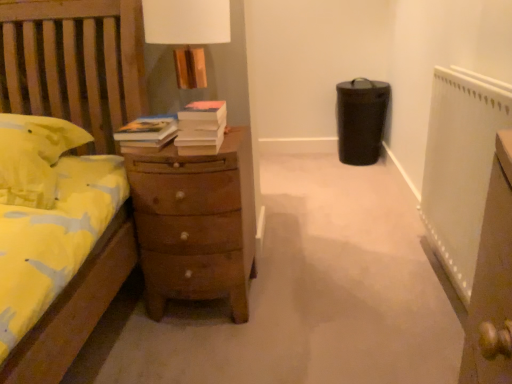
Question: Considering the relative positions of brown wooden chest of drawers at center and white matte book at center in the image provided, is brown wooden chest of drawers at center to the right of white matte book at center from the viewer's perspective?

Choices:
 (A) no
 (B) yes

Answer: (A)

Question: Considering the relative sizes of brown wooden chest of drawers at center and white matte book at center in the image provided, is brown wooden chest of drawers at center thinner than white matte book at center?

Choices:
 (A) no
 (B) yes

Answer: (A)

Question: Does brown wooden chest of drawers at center have a greater height compared to white matte book at center?

Choices:
 (A) no
 (B) yes

Answer: (B)

Question: From a real-world perspective, is brown wooden chest of drawers at center beneath white matte book at center?

Choices:
 (A) no
 (B) yes

Answer: (B)

Question: Considering the relative sizes of brown wooden chest of drawers at center and white matte book at center in the image provided, is brown wooden chest of drawers at center shorter than white matte book at center?

Choices:
 (A) yes
 (B) no

Answer: (B)

Question: Is white matte book at center at the back of brown wooden chest of drawers at center?

Choices:
 (A) no
 (B) yes

Answer: (A)

Question: Is white matte book at center smaller than white textured radiator at right?

Choices:
 (A) no
 (B) yes

Answer: (B)

Question: Is white matte book at center closer to camera compared to white textured radiator at right?

Choices:
 (A) no
 (B) yes

Answer: (A)

Question: Can you confirm if white matte book at center is positioned to the left of white textured radiator at right?

Choices:
 (A) yes
 (B) no

Answer: (A)

Question: Is white matte book at center positioned behind white textured radiator at right?

Choices:
 (A) no
 (B) yes

Answer: (B)

Question: From a real-world perspective, is white matte book at center beneath white textured radiator at right?

Choices:
 (A) yes
 (B) no

Answer: (B)

Question: From the image's perspective, is white matte book at center on top of white textured radiator at right?

Choices:
 (A) yes
 (B) no

Answer: (A)

Question: From a real-world perspective, is brown wooden chest of drawers at center physically above white textured radiator at right?

Choices:
 (A) yes
 (B) no

Answer: (B)